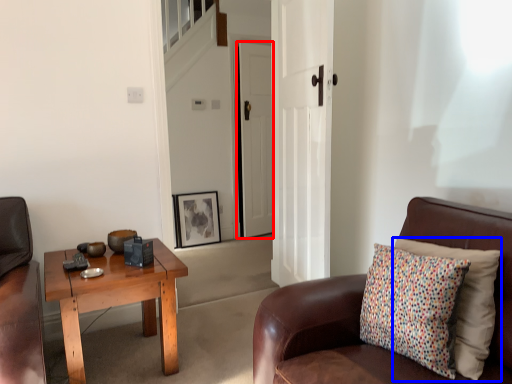
Question: Which point is closer to the camera, door (highlighted by a red box) or pillow (highlighted by a blue box)?

Choices:
 (A) door
 (B) pillow

Answer: (B)